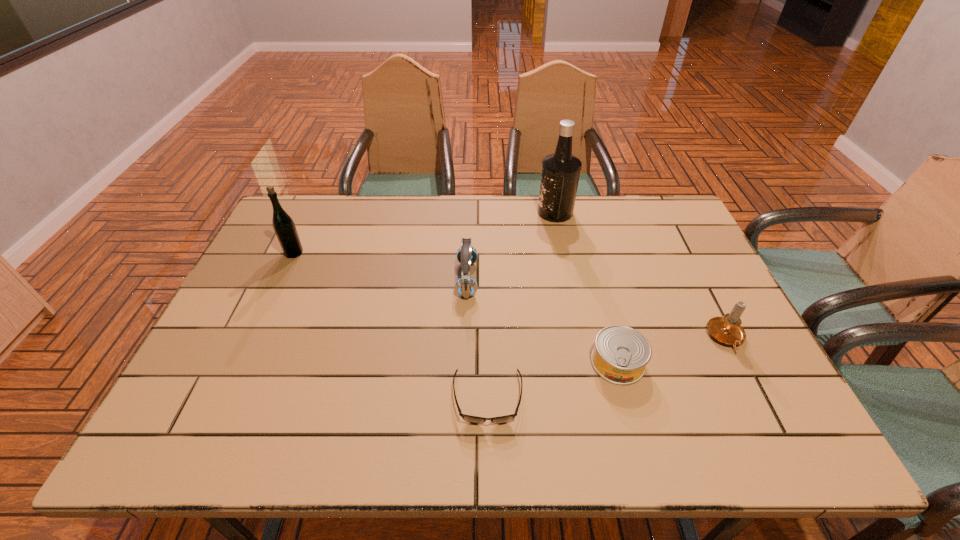
Where is `vacant region that satisfies the following two spatial constraints: 1. on the front label of the liquor; 2. on the front-facing side of the sunglasses`? vacant region that satisfies the following two spatial constraints: 1. on the front label of the liquor; 2. on the front-facing side of the sunglasses is located at coordinates point(594,399).

Locate an element on the screen. vacant space that satisfies the following two spatial constraints: 1. on the front label of the farthest object; 2. on the back side of the candle is located at coordinates (581, 338).

What are the coordinates of `vacant region that satisfies the following two spatial constraints: 1. on the ear cups of the candle; 2. on the left side of the headset` in the screenshot? It's located at (466, 338).

Identify the location of blank space that satisfies the following two spatial constraints: 1. on the front label of the fifth tallest object; 2. on the left side of the farthest object. (587, 362).